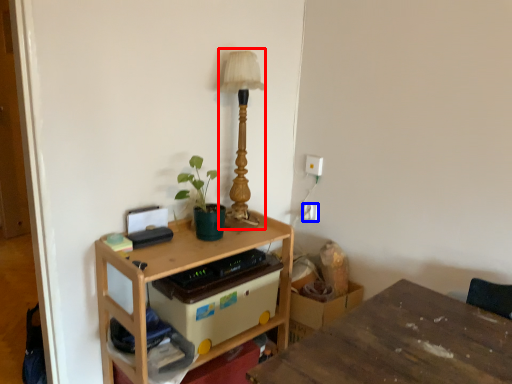
Question: Among these objects, which one is nearest to the camera, table lamp (highlighted by a red box) or electric outlet (highlighted by a blue box)?

Choices:
 (A) table lamp
 (B) electric outlet

Answer: (A)